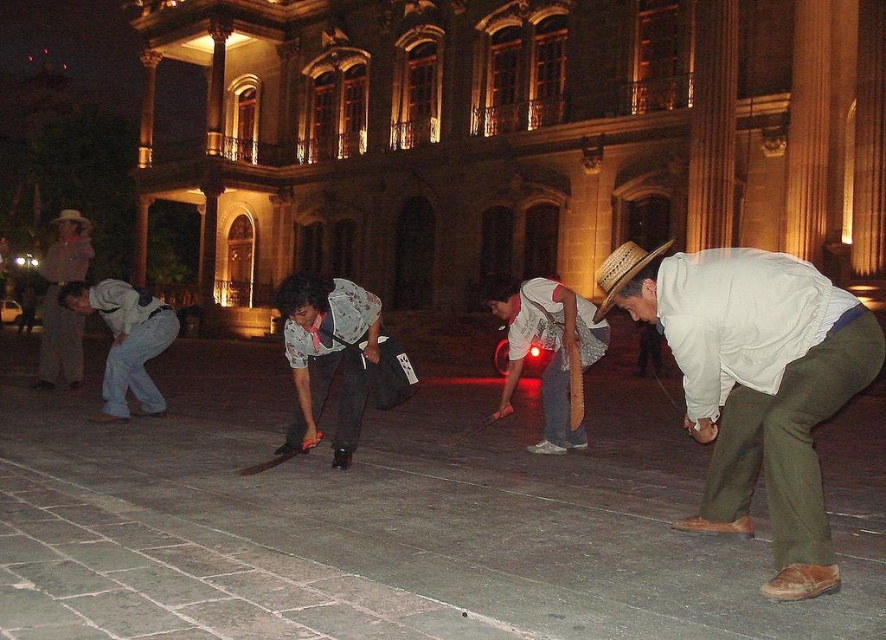
Is white cotton shirt at lower right further to camera compared to light gray cotton shirt at left?

No, white cotton shirt at lower right is in front of light gray cotton shirt at left.

Who is more distant from viewer, (748, 518) or (39, 371)?

The point (39, 371) is behind.

At what (x,y) coordinates should I click in order to perform the action: click on white cotton shirt at lower right. Please return your answer as a coordinate pair (x, y). Image resolution: width=886 pixels, height=640 pixels. Looking at the image, I should click on click(x=755, y=384).

At what (x,y) coordinates should I click in order to perform the action: click on white cotton shirt at lower right. Please return your answer as a coordinate pair (x, y). This screenshot has width=886, height=640. Looking at the image, I should click on (755, 384).

Can you confirm if light gray fabric shirt at left is positioned to the left of light gray cotton shirt at left?

Incorrect, light gray fabric shirt at left is not on the left side of light gray cotton shirt at left.

Is light gray fabric shirt at left closer to the viewer compared to light gray cotton shirt at left?

Yes, it is.

This screenshot has width=886, height=640. I want to click on light gray fabric shirt at left, so click(x=125, y=340).

Between point (721, 346) and point (153, 300), which one is positioned in front?

Point (721, 346) is in front.

Is point (779, 442) positioned in front of point (127, 296)?

That is True.

Locate an element on the screen. The height and width of the screenshot is (640, 886). white cotton shirt at lower right is located at coordinates (755, 384).